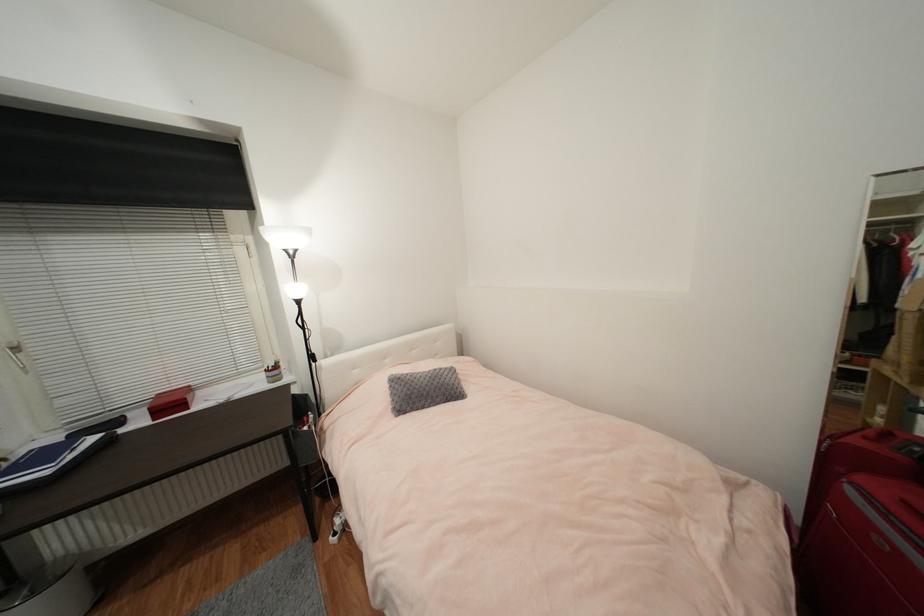
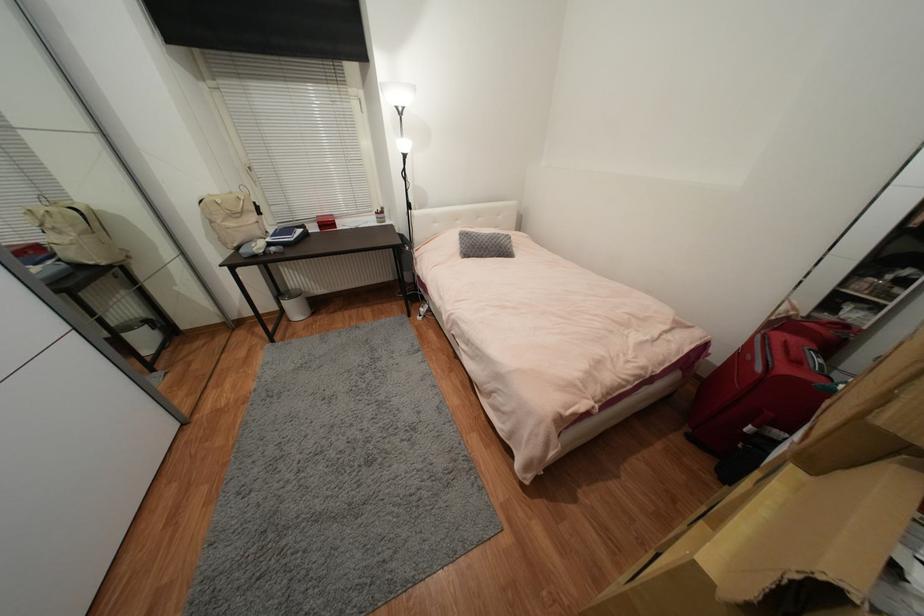
Question: Which direction would the cameraman need to move to produce the second image? Reply with the corresponding letter.

Choices:
 (A) Left
 (B) Right
 (C) Forward
 (D) Backward

Answer: (D)